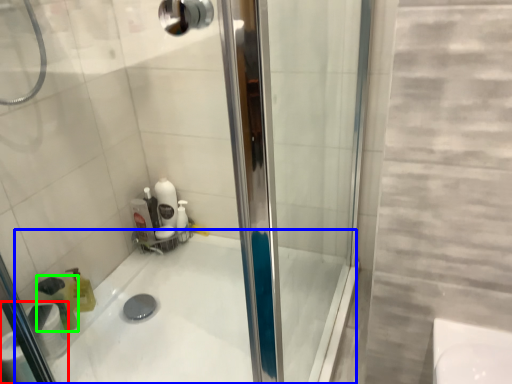
Question: Which object is the closest to the toilet paper (highlighted by a red box)? Choose among these: bath (highlighted by a blue box) or cleaning product (highlighted by a green box).

Choices:
 (A) bath
 (B) cleaning product

Answer: (B)